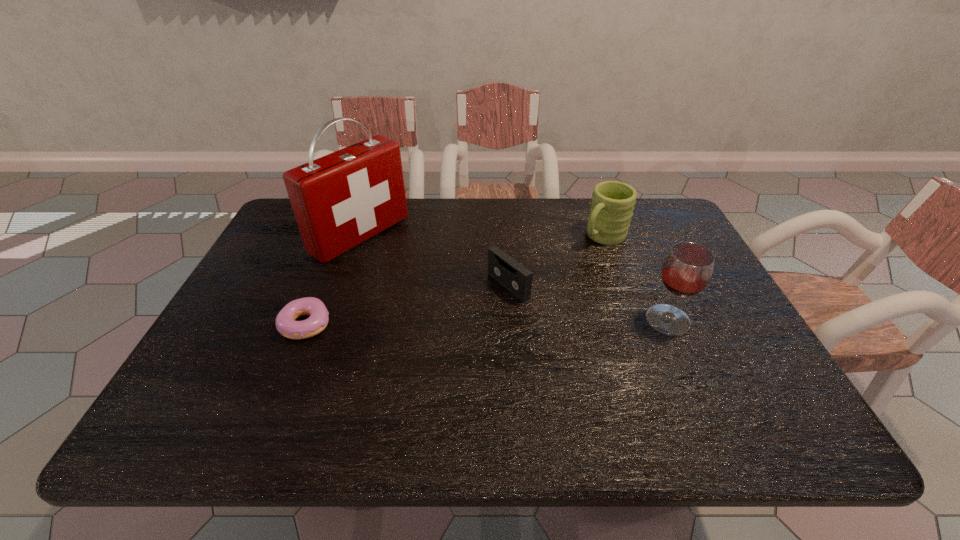
You are a GUI agent. You are given a task and a screenshot of the screen. Output one action in this format:
    pyautogui.click(x=<x>, y=<y>)
    Task: Click on the vacant space that satisfies the following two spatial constraints: 1. on the back side of the third object from right to left; 2. on the right side of the doughnut
    This screenshot has height=540, width=960.
    Given the screenshot: What is the action you would take?
    pyautogui.click(x=322, y=286)

Where is `free point that satisfies the following two spatial constraints: 1. on the back side of the third farthest object; 2. on the left side of the doughnut`? free point that satisfies the following two spatial constraints: 1. on the back side of the third farthest object; 2. on the left side of the doughnut is located at coordinates click(x=322, y=286).

Locate an element on the screen. vacant space that satisfies the following two spatial constraints: 1. on the front side of the mug; 2. on the right side of the first-aid kit is located at coordinates (360, 237).